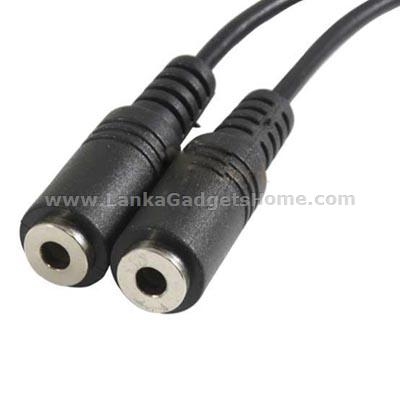
The height and width of the screenshot is (400, 400). Identify the location of black plugs. (201, 245), (127, 173).